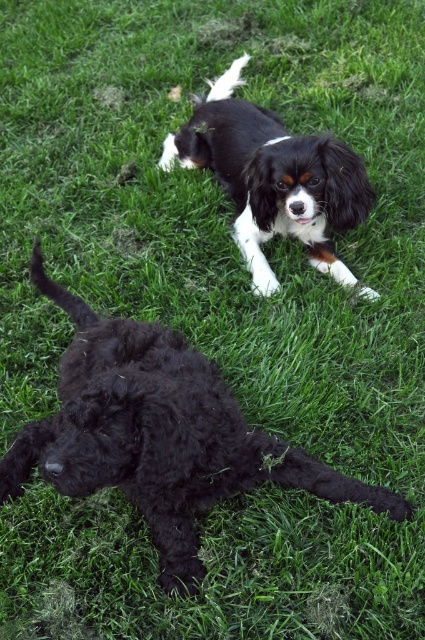
Question: Is fluffy black dog at lower left positioned in front of black silky dog at upper center?

Choices:
 (A) yes
 (B) no

Answer: (A)

Question: Which point is closer to the camera taking this photo?

Choices:
 (A) (161, 493)
 (B) (329, 260)

Answer: (A)

Question: Is fluffy black dog at lower left bigger than black silky dog at upper center?

Choices:
 (A) no
 (B) yes

Answer: (B)

Question: Among these points, which one is farthest from the camera?

Choices:
 (A) (215, 113)
 (B) (88, 483)

Answer: (A)

Question: Can you confirm if fluffy black dog at lower left is positioned to the right of black silky dog at upper center?

Choices:
 (A) no
 (B) yes

Answer: (A)